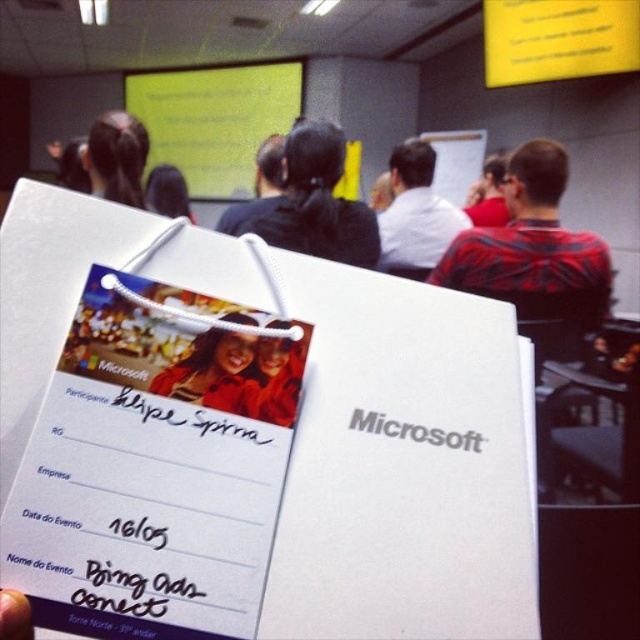
You are attending a Microsoft event and notice two distinct features in the foreground of the badge image. The first is a red and black striped shirt at upper right, and the second is matte black hair at upper center. Based on the spatial relationship between these two features, which one appears wider?

The red and black striped shirt at upper right appears wider than the matte black hair at upper center, as its width surpasses that of the matte black hair at upper center.

You are attending a Microsoft event and notice two shirts in the image. Which shirt, the white shirt at upper center or the matte black shirt at upper center, appears taller in the photo?

The white shirt at upper center appears taller than the matte black shirt at upper center in the photo.

You are organizing a photo shoot and need to position a matte red sweater exactly at the center of the image. According to the scene description, is the current placement of the matte red sweater at center correct?

The matte red sweater at center is located at point 2D coordinates of (275, 376). Since the center of an image is at coordinates (320, 320), the sweater is slightly off center to the right and down from the true center.